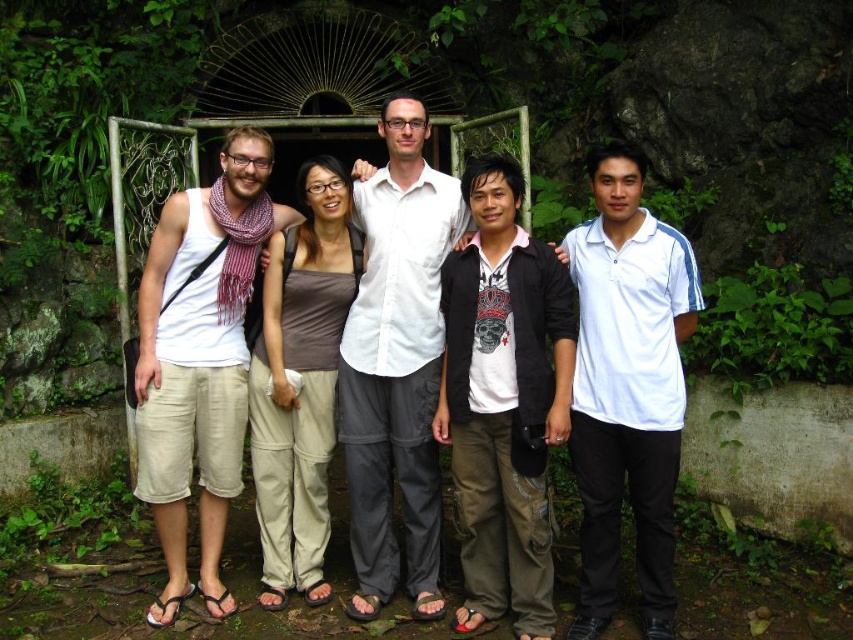
Does white smooth polo shirt at center have a larger size compared to white cotton tank top at left?

No, white smooth polo shirt at center is not bigger than white cotton tank top at left.

In the scene shown: Which is below, white smooth polo shirt at center or white cotton tank top at left?

white smooth polo shirt at center

Between point (643, 211) and point (254, 154), which one is positioned behind?

Point (254, 154)

Find the location of a particular element. The image size is (853, 640). white smooth polo shirt at center is located at coordinates (627, 385).

Between white matte shirt at center and white cotton shirt at center, which one appears on the left side from the viewer's perspective?

white matte shirt at center

Is white matte shirt at center in front of white cotton shirt at center?

No, white matte shirt at center is further to the viewer.

Find the location of a particular element. Image resolution: width=853 pixels, height=640 pixels. white matte shirt at center is located at coordinates (396, 362).

Which is more to the left, dark gray cotton shirt at center or white cotton shirt at center?

dark gray cotton shirt at center

Is dark gray cotton shirt at center in front of white cotton shirt at center?

No, it is not.

Is point (523, 480) farther from camera compared to point (392, 548)?

No, (523, 480) is closer to viewer.

Identify the location of dark gray cotton shirt at center. (503, 401).